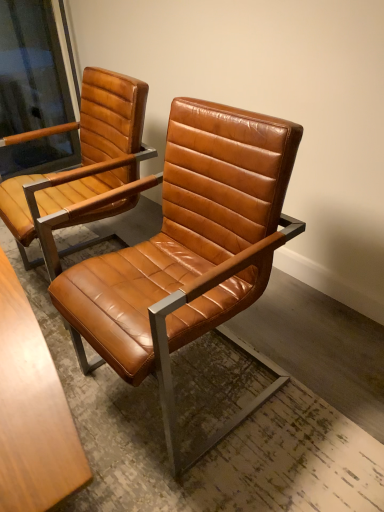
Question: Would you say cognac leather chair at center, which is counted as the 1th chair, starting from the left, contains cognac leather chair at center, positioned as the first chair in right-to-left order?

Choices:
 (A) no
 (B) yes

Answer: (A)

Question: Is cognac leather chair at center, which is counted as the 1th chair, starting from the left, with cognac leather chair at center, positioned as the first chair in right-to-left order?

Choices:
 (A) yes
 (B) no

Answer: (B)

Question: Considering the relative sizes of cognac leather chair at center, positioned as the second chair in right-to-left order, and cognac leather chair at center, positioned as the first chair in right-to-left order, in the image provided, is cognac leather chair at center, positioned as the second chair in right-to-left order, wider than cognac leather chair at center, positioned as the first chair in right-to-left order,?

Choices:
 (A) yes
 (B) no

Answer: (B)

Question: Is cognac leather chair at center, positioned as the second chair in right-to-left order, turned away from cognac leather chair at center, positioned as the first chair in right-to-left order?

Choices:
 (A) yes
 (B) no

Answer: (B)

Question: Is the position of cognac leather chair at center, which is counted as the 1th chair, starting from the left, more distant than that of cognac leather chair at center, which is counted as the 2th chair, starting from the left?

Choices:
 (A) yes
 (B) no

Answer: (A)

Question: From a real-world perspective, is cognac leather chair at center, which is counted as the 1th chair, starting from the left, beneath cognac leather chair at center, positioned as the first chair in right-to-left order?

Choices:
 (A) yes
 (B) no

Answer: (A)

Question: Is cognac leather chair at center, which is counted as the 2th chair, starting from the left, surrounding cognac leather chair at center, positioned as the second chair in right-to-left order?

Choices:
 (A) no
 (B) yes

Answer: (A)

Question: From the image's perspective, is cognac leather chair at center, which is counted as the 2th chair, starting from the left, above cognac leather chair at center, which is counted as the 1th chair, starting from the left?

Choices:
 (A) yes
 (B) no

Answer: (B)

Question: Considering the relative sizes of cognac leather chair at center, which is counted as the 2th chair, starting from the left, and cognac leather chair at center, positioned as the second chair in right-to-left order, in the image provided, is cognac leather chair at center, which is counted as the 2th chair, starting from the left, wider than cognac leather chair at center, positioned as the second chair in right-to-left order,?

Choices:
 (A) no
 (B) yes

Answer: (B)

Question: Considering the relative positions of cognac leather chair at center, positioned as the first chair in right-to-left order, and cognac leather chair at center, positioned as the second chair in right-to-left order, in the image provided, is cognac leather chair at center, positioned as the first chair in right-to-left order, to the left of cognac leather chair at center, positioned as the second chair in right-to-left order, from the viewer's perspective?

Choices:
 (A) no
 (B) yes

Answer: (A)

Question: Does cognac leather chair at center, positioned as the first chair in right-to-left order, have a smaller size compared to cognac leather chair at center, positioned as the second chair in right-to-left order?

Choices:
 (A) no
 (B) yes

Answer: (A)

Question: Is cognac leather chair at center, which is counted as the 2th chair, starting from the left, taller than cognac leather chair at center, which is counted as the 1th chair, starting from the left?

Choices:
 (A) no
 (B) yes

Answer: (B)

Question: Is cognac leather chair at center, positioned as the second chair in right-to-left order, at the back of matte brown leather chair arm at upper left?

Choices:
 (A) yes
 (B) no

Answer: (B)